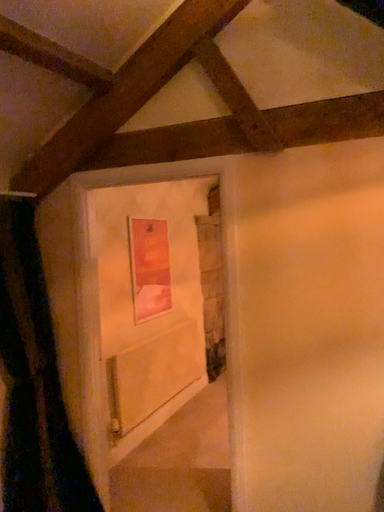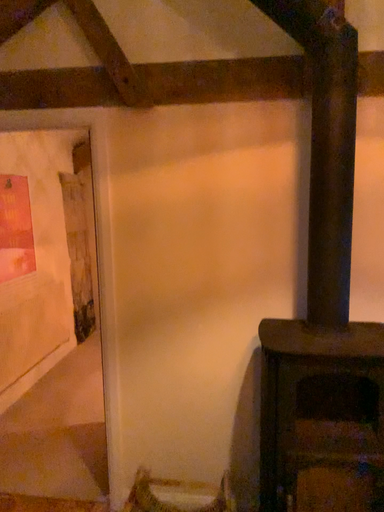
Question: How did the camera likely rotate when shooting the video?

Choices:
 (A) rotated left
 (B) rotated right

Answer: (B)